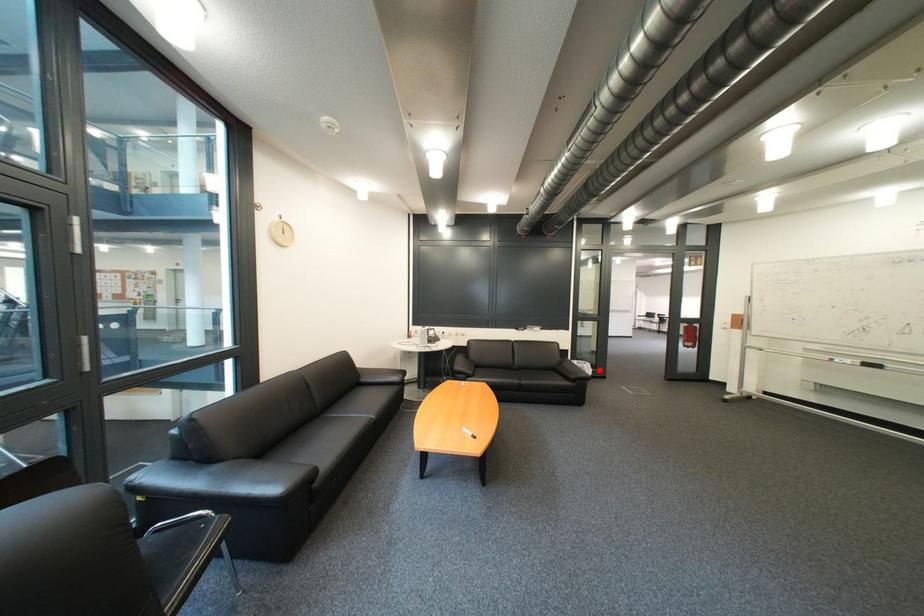
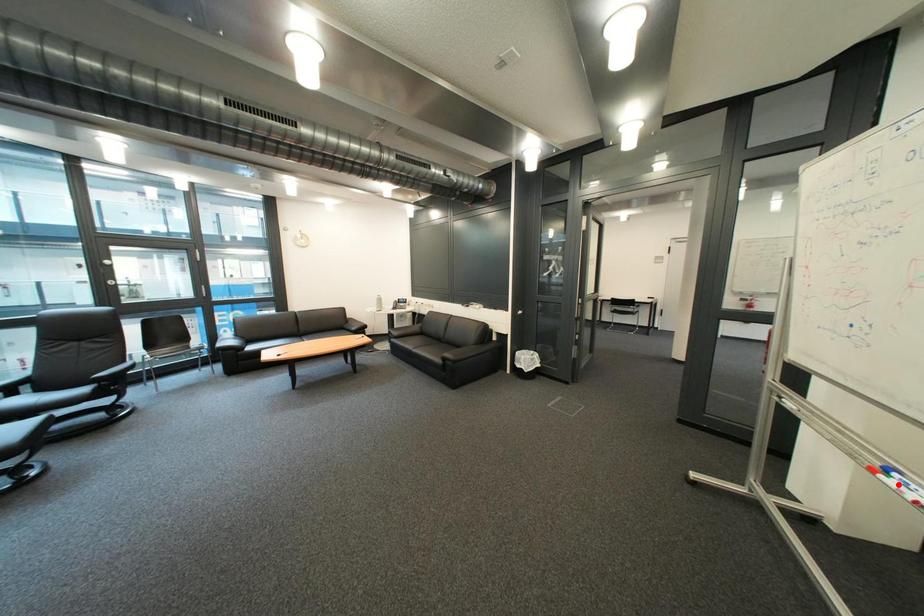
I am providing you with two images of the same scene from different viewpoints. A red point is marked on the first image and another point is marked on the second image. Is the marked point in image1 the same physical position as the marked point in image2?

No